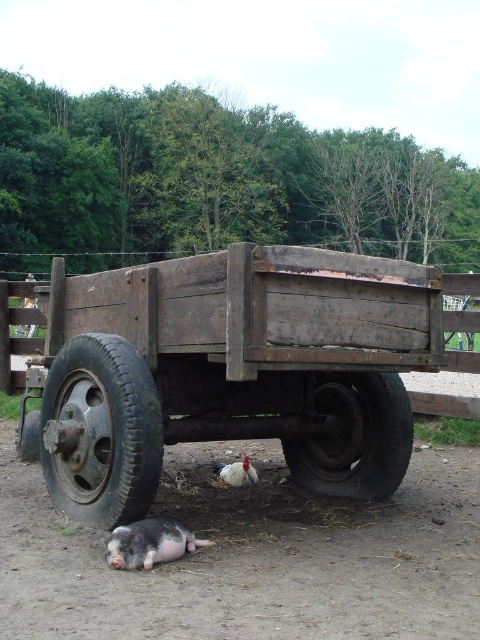
Question: Can you confirm if rustic wood cart at center is smaller than black rubber tire at lower left?

Choices:
 (A) no
 (B) yes

Answer: (A)

Question: Which object is closer to the camera taking this photo?

Choices:
 (A) piggy pink fur at lower center
 (B) black rubber tire at lower center

Answer: (A)

Question: Which object is the closest to the piggy pink fur at lower center?

Choices:
 (A) white glossy rooster at lower center
 (B) black rubber tire at lower left
 (C) brown dirt track at lower center
 (D) black rubber tire at lower center

Answer: (C)

Question: Among these points, which one is nearest to the camera?

Choices:
 (A) (195, 291)
 (B) (321, 396)

Answer: (A)

Question: Does rustic wood cart at center have a larger size compared to white glossy rooster at lower center?

Choices:
 (A) yes
 (B) no

Answer: (A)

Question: Does rustic wood cart at center appear on the right side of black rubber tire at lower center?

Choices:
 (A) no
 (B) yes

Answer: (A)